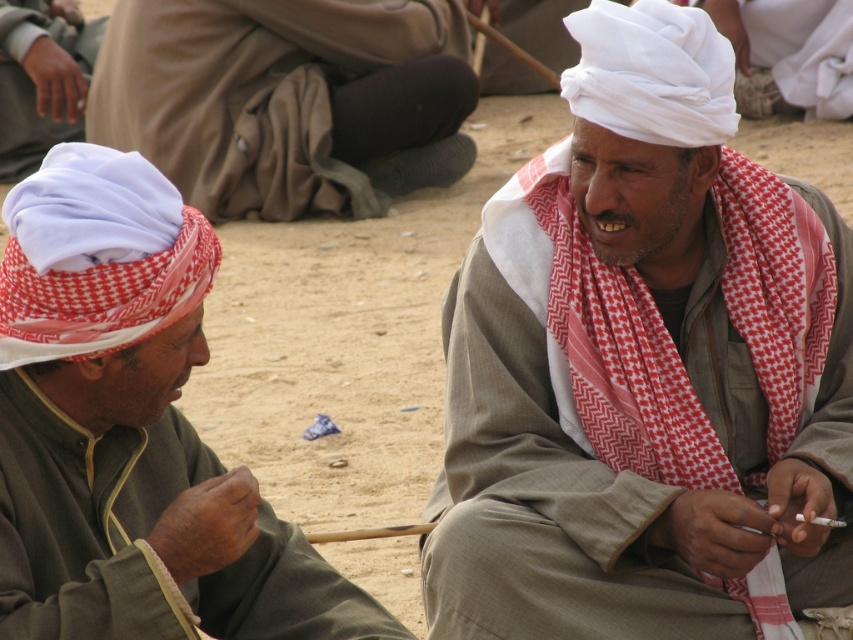
Question: Among these points, which one is farthest from the camera?

Choices:
 (A) (347, 1)
 (B) (22, 8)
 (C) (654, 211)

Answer: (B)

Question: Which point is closer to the camera taking this photo?

Choices:
 (A) (224, 618)
 (B) (15, 157)
 (C) (624, 568)
 (D) (331, 196)

Answer: (A)

Question: Is white woven turban at center bigger than white cotton turban at left?

Choices:
 (A) yes
 (B) no

Answer: (A)

Question: Which object appears closest to the camera in this image?

Choices:
 (A) white cotton turban at upper left
 (B) white woven turban at center
 (C) white cotton turban at left
 (D) white cloth at upper left

Answer: (C)

Question: Does white woven turban at center have a lesser width compared to white cotton turban at upper left?

Choices:
 (A) no
 (B) yes

Answer: (B)

Question: Can you confirm if white woven turban at center is positioned to the left of white cotton turban at left?

Choices:
 (A) yes
 (B) no

Answer: (B)